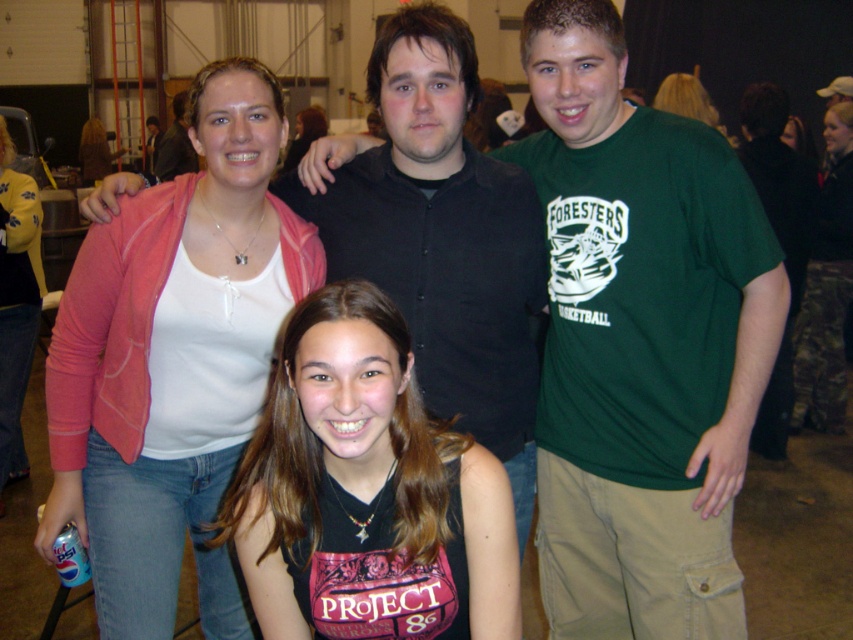
Is pink fabric at upper left positioned in front of matte white tank top at upper center?

Yes, it is in front of matte white tank top at upper center.

Does pink fabric at upper left appear on the right side of matte white tank top at upper center?

Yes, pink fabric at upper left is to the right of matte white tank top at upper center.

Who is more distant from viewer, (166, 365) or (83, 138)?

Positioned behind is point (83, 138).

Locate an element on the screen. This screenshot has height=640, width=853. pink fabric at upper left is located at coordinates (171, 349).

Between black matte tank top at center and matte yellow jacket at upper left, which one is positioned higher?

matte yellow jacket at upper left

Between black matte tank top at center and matte yellow jacket at upper left, which one has less height?

black matte tank top at center is shorter.

Is point (354, 472) more distant than point (30, 280)?

No, it is in front of (30, 280).

Where is `black matte tank top at center`? The image size is (853, 640). black matte tank top at center is located at coordinates (364, 490).

Is black shirt at upper center below matte white tank top at upper center?

Yes, black shirt at upper center is below matte white tank top at upper center.

Is point (418, 54) closer to viewer compared to point (79, 154)?

Yes, it is in front of point (79, 154).

Based on the photo, who is more distant from viewer, (111,189) or (88,145)?

The point (88,145) is more distant.

Where is `black shirt at upper center`? black shirt at upper center is located at coordinates (444, 240).